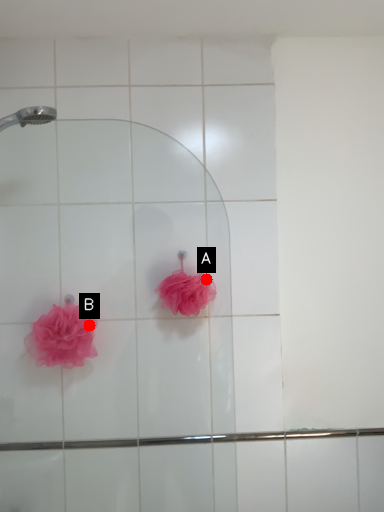
Question: Two points are circled on the image, labeled by A and B beside each circle. Which point is closer to the camera taking this photo?

Choices:
 (A) A is closer
 (B) B is closer

Answer: (A)